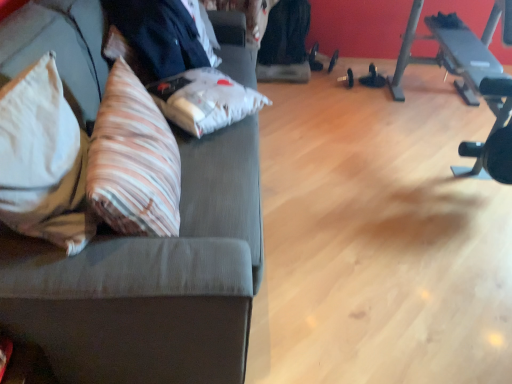
Where is `beige fabric pillow at left, marked as the 1th throw pillow in a left-to-right arrangement`? beige fabric pillow at left, marked as the 1th throw pillow in a left-to-right arrangement is located at coordinates (42, 160).

What do you see at coordinates (152, 281) in the screenshot? This screenshot has height=384, width=512. I see `textured gray couch at left` at bounding box center [152, 281].

Identify the location of black fabric businessman at upper left. Image resolution: width=512 pixels, height=384 pixels. (158, 37).

The width and height of the screenshot is (512, 384). In order to click on striped fabric pillow at center in this screenshot , I will do `click(205, 100)`.

This screenshot has width=512, height=384. What are the coordinates of `black rubber barbell at right` in the screenshot? It's located at (492, 138).

Locate an element on the screen. black rubber dumbbell at center is located at coordinates (373, 78).

Locate an element on the screen. This screenshot has width=512, height=384. dumbbell located above the black rubber barbell at right (from the image's perspective) is located at coordinates (373, 78).

Considering the sizes of objects black rubber dumbbell at center and black rubber barbell at right in the image provided, who is shorter, black rubber dumbbell at center or black rubber barbell at right?

With less height is black rubber dumbbell at center.

Does black rubber dumbbell at center have a larger size compared to black rubber barbell at right?

No, black rubber dumbbell at center is not bigger than black rubber barbell at right.

Considering the positions of objects black rubber dumbbell at center and black rubber barbell at right in the image provided, who is more to the right, black rubber dumbbell at center or black rubber barbell at right?

black rubber barbell at right.

Find the location of `barbell located behind the black fabric businessman at upper left`. barbell located behind the black fabric businessman at upper left is located at coordinates (x=492, y=138).

Which object is wider, black fabric businessman at upper left or black rubber barbell at right?

Wider between the two is black fabric businessman at upper left.

Who is shorter, black fabric businessman at upper left or black rubber barbell at right?

black fabric businessman at upper left.

Is black fabric businessman at upper left completely or partially outside of black rubber barbell at right?

Indeed, black fabric businessman at upper left is completely outside black rubber barbell at right.

From a real-world perspective, which object stands above the other?

black fabric businessman at upper left is physically above.

Consider the image. Does textured gray couch at left have a greater width compared to black fabric businessman at upper left?

Yes.

Does textured gray couch at left lie behind black fabric businessman at upper left?

No, the depth of textured gray couch at left is less than that of black fabric businessman at upper left.

From their relative heights in the image, would you say textured gray couch at left is taller or shorter than black fabric businessman at upper left?

Considering their sizes, textured gray couch at left has more height than black fabric businessman at upper left.

Is striped fabric throw pillow at left, which appears as the second throw pillow when viewed from the left, facing away from textured gray couch at left?

Yes, striped fabric throw pillow at left, which appears as the second throw pillow when viewed from the left, is positioned with its back facing textured gray couch at left.

In the scene shown: Is striped fabric throw pillow at left, which appears as the second throw pillow when viewed from the left, not close to textured gray couch at left?

That's not correct — striped fabric throw pillow at left, which appears as the second throw pillow when viewed from the left, is a little close to textured gray couch at left.

Considering the sizes of striped fabric throw pillow at left, which is counted as the first throw pillow, starting from the right, and textured gray couch at left in the image, is striped fabric throw pillow at left, which is counted as the first throw pillow, starting from the right, taller or shorter than textured gray couch at left?

striped fabric throw pillow at left, which is counted as the first throw pillow, starting from the right, is shorter than textured gray couch at left.

Considering the points (81, 202) and (502, 137), which point is in front, point (81, 202) or point (502, 137)?

The point (81, 202) is more forward.

From a real-world perspective, is beige fabric pillow at left, the second throw pillow viewed from the right, over black rubber barbell at right?

Indeed, from a real-world perspective, beige fabric pillow at left, the second throw pillow viewed from the right, stands above black rubber barbell at right.

Looking at their sizes, would you say beige fabric pillow at left, marked as the 1th throw pillow in a left-to-right arrangement, is wider or thinner than black rubber barbell at right?

In the image, beige fabric pillow at left, marked as the 1th throw pillow in a left-to-right arrangement, appears to be wider than black rubber barbell at right.

Consider the image. How different are the orientations of beige fabric pillow at left, marked as the 1th throw pillow in a left-to-right arrangement, and black rubber barbell at right in degrees?

They differ by 97.7 degrees in their facing directions.

Is textured gray couch at left with striped fabric throw pillow at left, which is counted as the first throw pillow, starting from the right?

textured gray couch at left is not next to striped fabric throw pillow at left, which is counted as the first throw pillow, starting from the right, and they're not touching.

From the image's perspective, does textured gray couch at left appear lower than striped fabric throw pillow at left, which is counted as the first throw pillow, starting from the right?

No, from the image's perspective, textured gray couch at left is not below striped fabric throw pillow at left, which is counted as the first throw pillow, starting from the right.

How different are the orientations of textured gray couch at left and striped fabric throw pillow at left, which appears as the second throw pillow when viewed from the left, in degrees?

textured gray couch at left and striped fabric throw pillow at left, which appears as the second throw pillow when viewed from the left, are facing 14.5 degrees away from each other.

Who is bigger, textured gray couch at left or striped fabric throw pillow at left, which is counted as the first throw pillow, starting from the right?

textured gray couch at left.

Consider the image. Does black rubber barbell at right have a greater width compared to beige fabric pillow at left, the second throw pillow viewed from the right?

No.

How much distance is there between black rubber barbell at right and beige fabric pillow at left, marked as the 1th throw pillow in a left-to-right arrangement?

They are 1.85 meters apart.

From a real-world perspective, relative to beige fabric pillow at left, the second throw pillow viewed from the right, is black rubber barbell at right vertically above or below?

From a real-world perspective, black rubber barbell at right is physically below beige fabric pillow at left, the second throw pillow viewed from the right.

The image size is (512, 384). I want to click on the 2nd throw pillow in front of the black rubber barbell at right, so click(x=42, y=160).

Find the location of a particular element. The width and height of the screenshot is (512, 384). barbell in front of the black rubber dumbbell at center is located at coordinates (492, 138).

Find the location of a particular element. The height and width of the screenshot is (384, 512). barbell located below the black fabric businessman at upper left (from the image's perspective) is located at coordinates (492, 138).

Estimate the real-world distances between objects in this image. Which object is closer to black rubber dumbbell at center, striped fabric pillow at center or black fabric businessman at upper left?

Based on the image, striped fabric pillow at center appears to be nearer to black rubber dumbbell at center.

Which object lies further to the anchor point black rubber dumbbell at center, black rubber barbell at right or textured gray couch at left?

textured gray couch at left.

From the image, which object appears to be farther from striped fabric throw pillow at left, which appears as the second throw pillow when viewed from the left, striped fabric pillow at center or black fabric businessman at upper left?

black fabric businessman at upper left.

Based on their spatial positions, is striped fabric throw pillow at left, which is counted as the first throw pillow, starting from the right, or black rubber dumbbell at center closer to beige fabric pillow at left, marked as the 1th throw pillow in a left-to-right arrangement?

striped fabric throw pillow at left, which is counted as the first throw pillow, starting from the right, lies closer to beige fabric pillow at left, marked as the 1th throw pillow in a left-to-right arrangement, than the other object.

Based on their spatial positions, is black rubber dumbbell at center or black rubber barbell at right closer to black fabric businessman at upper left?

black rubber barbell at right is closer to black fabric businessman at upper left.

Estimate the real-world distances between objects in this image. Which object is further from textured gray couch at left, black rubber dumbbell at center or black fabric businessman at upper left?

black rubber dumbbell at center lies further to textured gray couch at left than the other object.

Looking at the image, which one is located closer to textured gray couch at left, striped fabric pillow at center or black rubber dumbbell at center?

striped fabric pillow at center.

Consider the image. Considering their positions, is beige fabric pillow at left, marked as the 1th throw pillow in a left-to-right arrangement, positioned further to striped fabric pillow at center than black rubber dumbbell at center?

black rubber dumbbell at center lies further to striped fabric pillow at center than the other object.

Where is `pillow between striped fabric throw pillow at left, which appears as the second throw pillow when viewed from the left, and black rubber barbell at right from left to right`? pillow between striped fabric throw pillow at left, which appears as the second throw pillow when viewed from the left, and black rubber barbell at right from left to right is located at coordinates (205, 100).

The image size is (512, 384). Find the location of `barbell between textured gray couch at left and black rubber dumbbell at center along the z-axis`. barbell between textured gray couch at left and black rubber dumbbell at center along the z-axis is located at coordinates (492, 138).

The height and width of the screenshot is (384, 512). Identify the location of throw pillow between black fabric businessman at upper left and beige fabric pillow at left, the second throw pillow viewed from the right, in the up-down direction. (133, 161).

You are a GUI agent. You are given a task and a screenshot of the screen. Output one action in this format:
    pyautogui.click(x=<x>, y=<y>)
    Task: Click on the businessman between textured gray couch at left and black rubber dumbbell at center along the z-axis
    
    Given the screenshot: What is the action you would take?
    pyautogui.click(x=158, y=37)